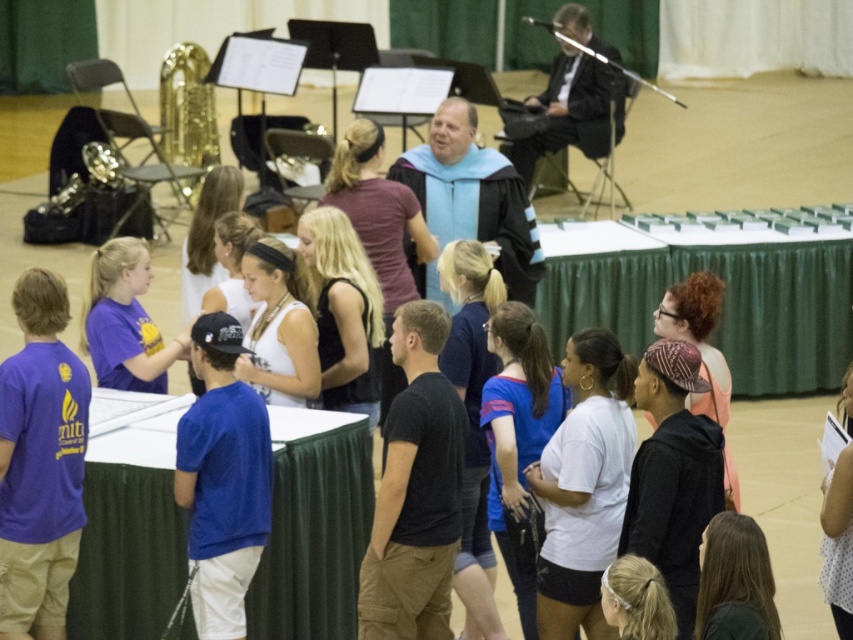
Question: Is light blue fabric graduation gown at center positioned behind black suit at upper right?

Choices:
 (A) yes
 (B) no

Answer: (B)

Question: Among these points, which one is nearest to the camera?

Choices:
 (A) (566, 20)
 (B) (190, 136)
 (C) (433, 196)

Answer: (C)

Question: Which object is farther from the camera taking this photo?

Choices:
 (A) gold brass saxophone at upper left
 (B) black suit at upper right

Answer: (B)

Question: Which point is closer to the camera taking this photo?

Choices:
 (A) (202, 164)
 (B) (490, 221)
 (C) (573, 58)

Answer: (B)

Question: Where is light blue fabric graduation gown at center located in relation to gold brass saxophone at upper left in the image?

Choices:
 (A) right
 (B) left

Answer: (A)

Question: Can you confirm if black suit at upper right is thinner than gold brass saxophone at upper left?

Choices:
 (A) yes
 (B) no

Answer: (B)